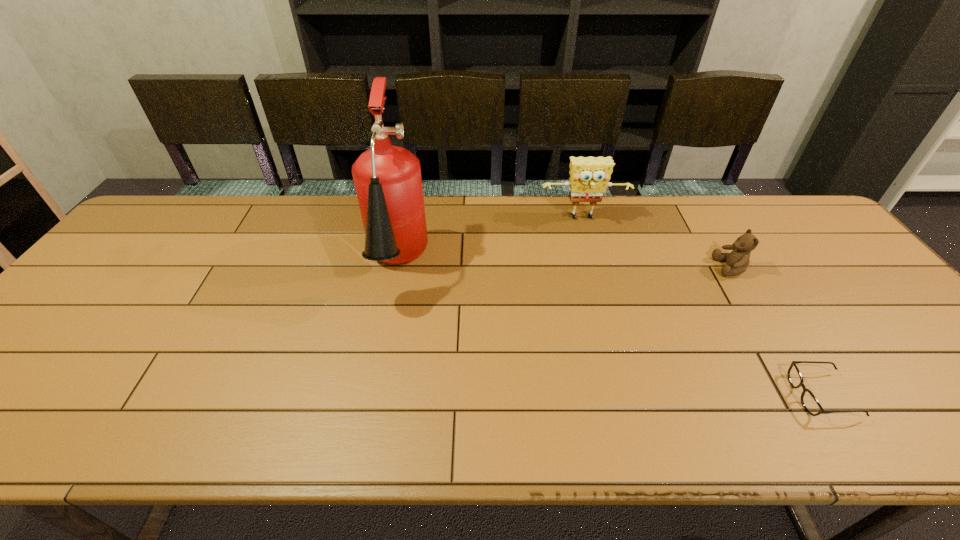
The width and height of the screenshot is (960, 540). What are the coordinates of `the tallest object` in the screenshot? It's located at (387, 179).

I want to click on fire extinguisher, so click(x=387, y=179).

Image resolution: width=960 pixels, height=540 pixels. Find the location of `sponge`. sponge is located at coordinates (589, 176).

The image size is (960, 540). In order to click on the third shortest object in this screenshot , I will do `click(589, 176)`.

This screenshot has height=540, width=960. I want to click on the second shortest object, so click(x=737, y=261).

Where is `the shortest object`? the shortest object is located at coordinates pyautogui.click(x=809, y=401).

In order to click on spectacles in this screenshot , I will do `click(809, 401)`.

I want to click on vacant space located 0.050m with the nozzle aimed from the fire extinguisher, so click(x=385, y=326).

I want to click on free spot located on the face of the sponge, so click(x=612, y=326).

Identify the location of free space located 0.230m on the front-facing side of the teddy bear. (634, 267).